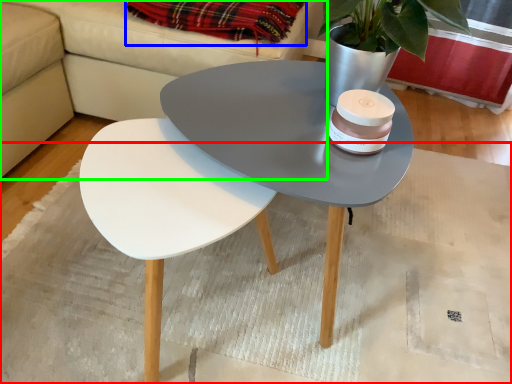
Question: Estimate the real-world distances between objects in this image. Which object is farther from mat (highlighted by a red box), blanket (highlighted by a blue box) or couch (highlighted by a green box)?

Choices:
 (A) blanket
 (B) couch

Answer: (A)